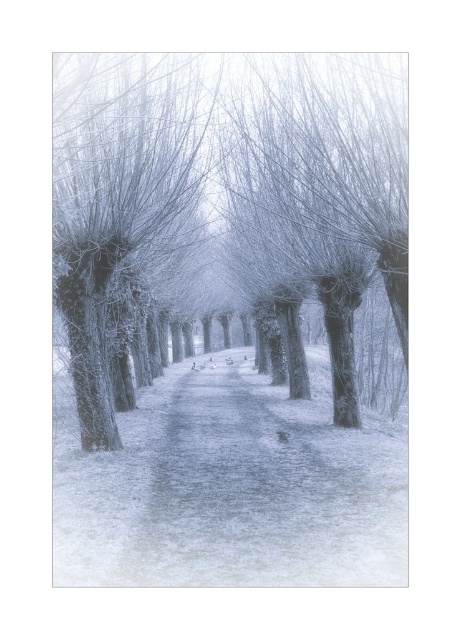
Between point (82, 275) and point (187, 468), which one is positioned in front?

Positioned in front is point (187, 468).

Between smooth bark trees at center and snowy gravel path at center, which one has less height?

Standing shorter between the two is snowy gravel path at center.

You are a GUI agent. You are given a task and a screenshot of the screen. Output one action in this format:
    pyautogui.click(x=<x>, y=<y>)
    Task: Click on the smooth bark trees at center
    The image size is (461, 640).
    Given the screenshot: What is the action you would take?
    pyautogui.click(x=231, y=204)

Identify the location of smooth bark trees at center. Image resolution: width=461 pixels, height=640 pixels. (231, 204).

Which is below, smooth bark trees at center or smooth bark tree at center?

smooth bark trees at center is lower down.

Does point (301, 196) come farther from viewer compared to point (72, 381)?

Yes, it is behind point (72, 381).

The image size is (461, 640). In order to click on smooth bark trees at center in this screenshot , I will do `click(231, 204)`.

Which is more to the left, snowy gravel path at center or smooth bark tree at center?

smooth bark tree at center is more to the left.

Is snowy gravel path at center in front of smooth bark tree at center?

No, it is behind smooth bark tree at center.

Locate an element on the screen. The height and width of the screenshot is (640, 461). snowy gravel path at center is located at coordinates (231, 490).

Find the location of a particular element. The image size is (461, 640). snowy gravel path at center is located at coordinates (231, 490).